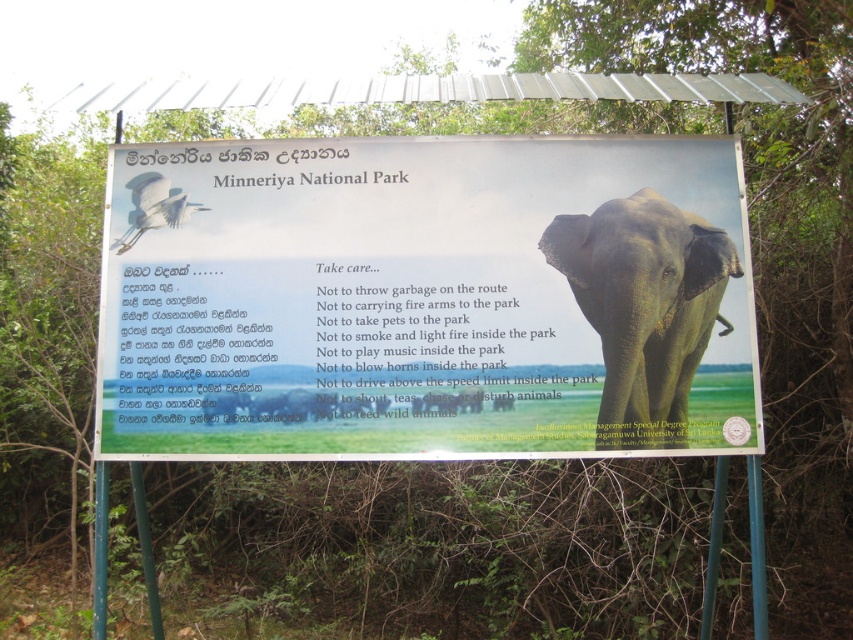
Question: Is matte white signboard at center thinner than gray matte elephant at center?

Choices:
 (A) yes
 (B) no

Answer: (B)

Question: Does gray matte elephant at center appear over white glossy bird at upper left?

Choices:
 (A) no
 (B) yes

Answer: (A)

Question: Among these objects, which one is farthest from the camera?

Choices:
 (A) white glossy bird at upper left
 (B) gray matte elephant at center

Answer: (A)

Question: Estimate the real-world distances between objects in this image. Which object is closer to the white glossy bird at upper left?

Choices:
 (A) gray matte elephant at center
 (B) matte white signboard at center

Answer: (B)

Question: Can you confirm if gray matte elephant at center is positioned below white glossy bird at upper left?

Choices:
 (A) no
 (B) yes

Answer: (B)

Question: Which object is farther from the camera taking this photo?

Choices:
 (A) matte white signboard at center
 (B) gray matte elephant at center

Answer: (B)